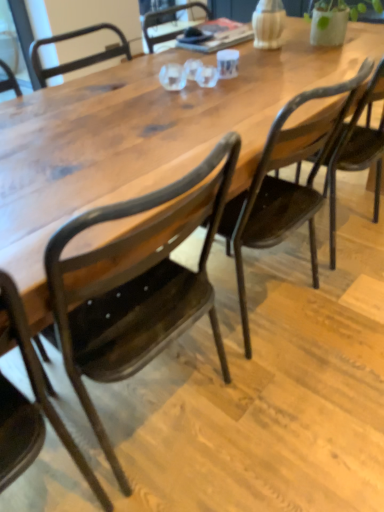
Question: Considering the relative positions of matte black chair at center, which appears as the second chair when viewed from the left, and matte dark wood chair at center, which appears as the 1th chair when viewed from the right, in the image provided, is matte black chair at center, which appears as the second chair when viewed from the left, in front of matte dark wood chair at center, which appears as the 1th chair when viewed from the right,?

Choices:
 (A) no
 (B) yes

Answer: (B)

Question: Would you say matte black chair at center, which appears as the second chair when viewed from the left, is outside matte dark wood chair at center, which appears as the 1th chair when viewed from the right?

Choices:
 (A) no
 (B) yes

Answer: (B)

Question: Can you confirm if matte black chair at center, which is the second chair from right to left, is bigger than matte dark wood chair at center, which ranks as the third chair in left-to-right order?

Choices:
 (A) no
 (B) yes

Answer: (B)

Question: Does matte black chair at center, which is the second chair from right to left, have a greater width compared to matte dark wood chair at center, which ranks as the third chair in left-to-right order?

Choices:
 (A) no
 (B) yes

Answer: (A)

Question: Is matte black chair at center, which is the second chair from right to left, thinner than matte dark wood chair at center, which ranks as the third chair in left-to-right order?

Choices:
 (A) no
 (B) yes

Answer: (B)

Question: Considering the relative sizes of matte black chair at center, which appears as the second chair when viewed from the left, and matte dark wood chair at center, which appears as the 1th chair when viewed from the right, in the image provided, is matte black chair at center, which appears as the second chair when viewed from the left, smaller than matte dark wood chair at center, which appears as the 1th chair when viewed from the right,?

Choices:
 (A) no
 (B) yes

Answer: (A)

Question: Is metallic dark brown chair at lower left, which is the 1th chair in left-to-right order, to the right of matte black chair at center, which is the second chair from right to left, from the viewer's perspective?

Choices:
 (A) no
 (B) yes

Answer: (A)

Question: Considering the relative positions of metallic dark brown chair at lower left, which is the 1th chair in left-to-right order, and matte black chair at center, which appears as the second chair when viewed from the left, in the image provided, is metallic dark brown chair at lower left, which is the 1th chair in left-to-right order, in front of matte black chair at center, which appears as the second chair when viewed from the left,?

Choices:
 (A) yes
 (B) no

Answer: (A)

Question: Considering the relative sizes of metallic dark brown chair at lower left, which is the 1th chair in left-to-right order, and matte black chair at center, which appears as the second chair when viewed from the left, in the image provided, is metallic dark brown chair at lower left, which is the 1th chair in left-to-right order, taller than matte black chair at center, which appears as the second chair when viewed from the left,?

Choices:
 (A) no
 (B) yes

Answer: (B)

Question: From the image's perspective, would you say metallic dark brown chair at lower left, which is the 1th chair in left-to-right order, is shown under matte black chair at center, which appears as the second chair when viewed from the left?

Choices:
 (A) yes
 (B) no

Answer: (A)

Question: Is metallic dark brown chair at lower left, which appears as the 3th chair when viewed from the right, facing towards matte black chair at center, which appears as the second chair when viewed from the left?

Choices:
 (A) yes
 (B) no

Answer: (B)

Question: Is metallic dark brown chair at lower left, which is the 1th chair in left-to-right order, facing away from matte black chair at center, which is the second chair from right to left?

Choices:
 (A) yes
 (B) no

Answer: (B)

Question: Considering the relative sizes of matte black chair at center, which is the second chair from right to left, and metallic dark brown chair at lower left, which is the 1th chair in left-to-right order, in the image provided, is matte black chair at center, which is the second chair from right to left, shorter than metallic dark brown chair at lower left, which is the 1th chair in left-to-right order,?

Choices:
 (A) yes
 (B) no

Answer: (A)